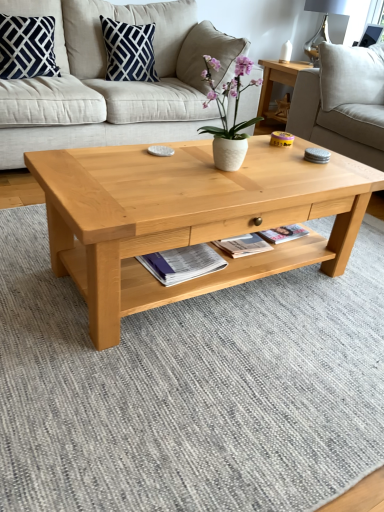
Question: Is navy blue cotton pillow at upper center, which is the second pillow in left-to-right order, positioned far away from navy blue cotton pillow at upper left, which is the 1th pillow in left-to-right order?

Choices:
 (A) yes
 (B) no

Answer: (B)

Question: Considering the relative sizes of navy blue cotton pillow at upper center, which is the second pillow in left-to-right order, and navy blue cotton pillow at upper left, the second pillow when ordered from right to left, in the image provided, is navy blue cotton pillow at upper center, which is the second pillow in left-to-right order, wider than navy blue cotton pillow at upper left, the second pillow when ordered from right to left,?

Choices:
 (A) no
 (B) yes

Answer: (B)

Question: Would you say navy blue cotton pillow at upper center, the 1th pillow positioned from the right, is outside navy blue cotton pillow at upper left, the second pillow when ordered from right to left?

Choices:
 (A) no
 (B) yes

Answer: (B)

Question: Is navy blue cotton pillow at upper center, the 1th pillow positioned from the right, touching navy blue cotton pillow at upper left, which is the 1th pillow in left-to-right order?

Choices:
 (A) no
 (B) yes

Answer: (A)

Question: Is navy blue cotton pillow at upper center, the 1th pillow positioned from the right, thinner than navy blue cotton pillow at upper left, the second pillow when ordered from right to left?

Choices:
 (A) no
 (B) yes

Answer: (A)

Question: Looking at the image, does matte paper magazine at center seem bigger or smaller compared to light beige fabric studio couch at upper right, positioned as the 2th studio couch in left-to-right order?

Choices:
 (A) small
 (B) big

Answer: (A)

Question: Is point (215, 264) closer or farther from the camera than point (337, 126)?

Choices:
 (A) closer
 (B) farther

Answer: (A)

Question: Considering their positions, is matte paper magazine at center located in front of or behind light beige fabric studio couch at upper right, positioned as the 2th studio couch in left-to-right order?

Choices:
 (A) front
 (B) behind

Answer: (A)

Question: Is matte paper magazine at center taller or shorter than light beige fabric studio couch at upper right, positioned as the 2th studio couch in left-to-right order?

Choices:
 (A) tall
 (B) short

Answer: (B)

Question: Is point (132, 65) closer or farther from the camera than point (236, 59)?

Choices:
 (A) closer
 (B) farther

Answer: (B)

Question: Based on their positions, is navy blue cotton pillow at upper center, which is the second pillow in left-to-right order, located to the left or right of white ceramic vase at center?

Choices:
 (A) right
 (B) left

Answer: (B)

Question: From the image's perspective, relative to white ceramic vase at center, is navy blue cotton pillow at upper center, which is the second pillow in left-to-right order, above or below?

Choices:
 (A) above
 (B) below

Answer: (A)

Question: In terms of height, does navy blue cotton pillow at upper center, the 1th pillow positioned from the right, look taller or shorter compared to white ceramic vase at center?

Choices:
 (A) short
 (B) tall

Answer: (B)

Question: From a real-world perspective, is navy blue cotton pillow at upper left, the second pillow when ordered from right to left, physically located above or below beige fabric couch at center, arranged as the second studio couch when viewed from the right?

Choices:
 (A) above
 (B) below

Answer: (A)

Question: Considering the positions of navy blue cotton pillow at upper left, which is the 1th pillow in left-to-right order, and beige fabric couch at center, arranged as the second studio couch when viewed from the right, in the image, is navy blue cotton pillow at upper left, which is the 1th pillow in left-to-right order, bigger or smaller than beige fabric couch at center, arranged as the second studio couch when viewed from the right,?

Choices:
 (A) big
 (B) small

Answer: (B)